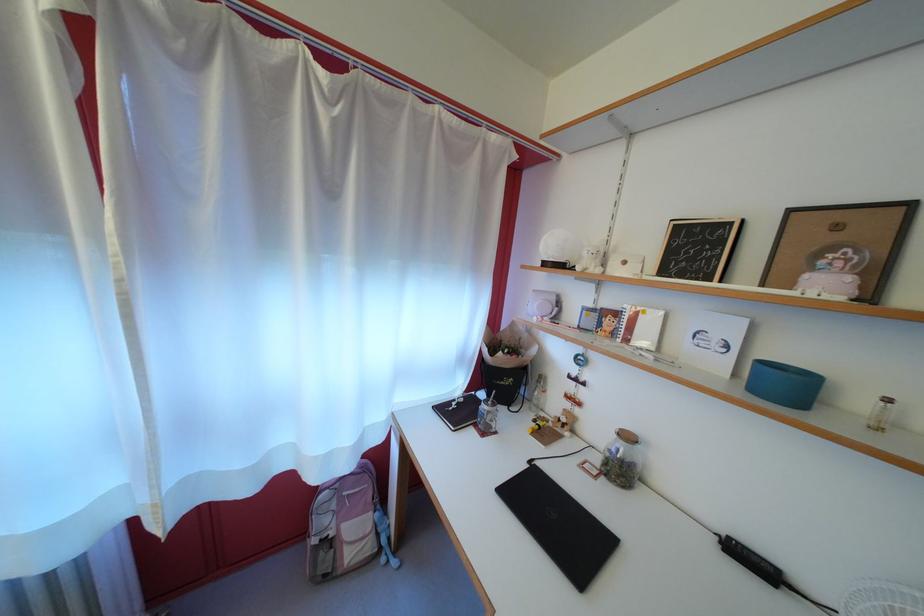
Which object does [558,249] point to?

It refers to a spherical moon lamp.